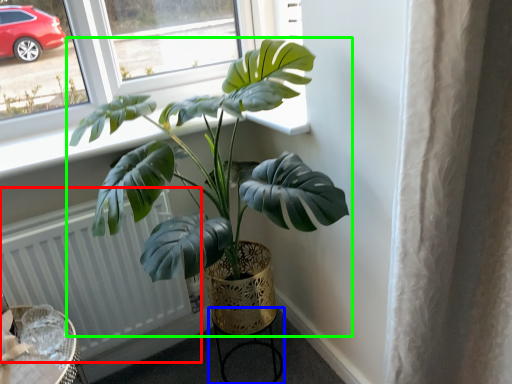
Question: Estimate the real-world distances between objects in this image. Which object is closer to radiator (highlighted by a red box), round table (highlighted by a blue box) or houseplant (highlighted by a green box)?

Choices:
 (A) round table
 (B) houseplant

Answer: (B)